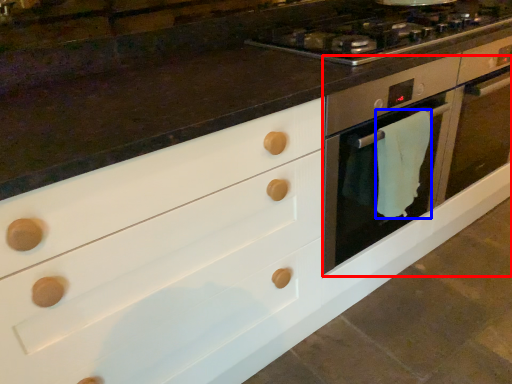
Question: Which object is closer to the camera taking this photo, oven (highlighted by a red box) or material (highlighted by a blue box)?

Choices:
 (A) oven
 (B) material

Answer: (B)